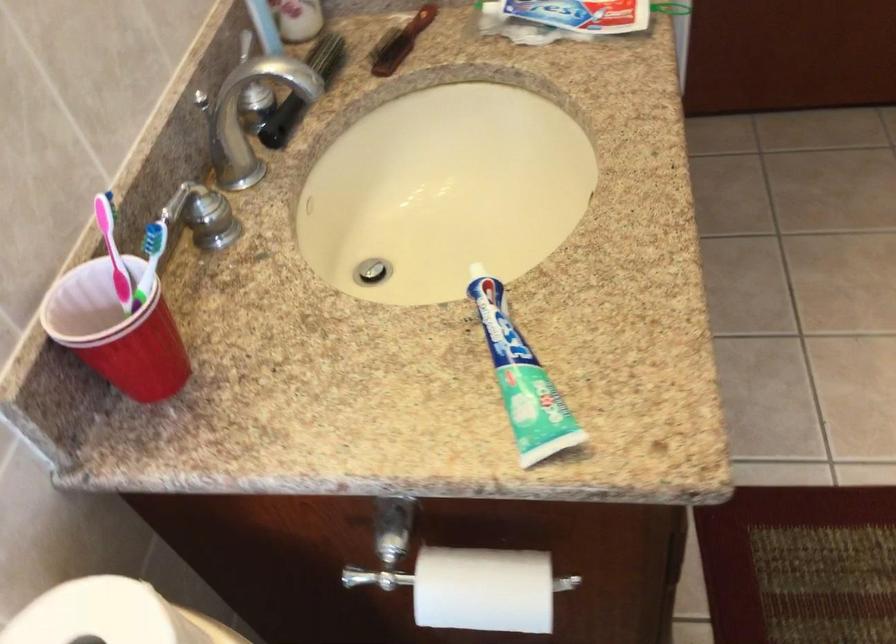
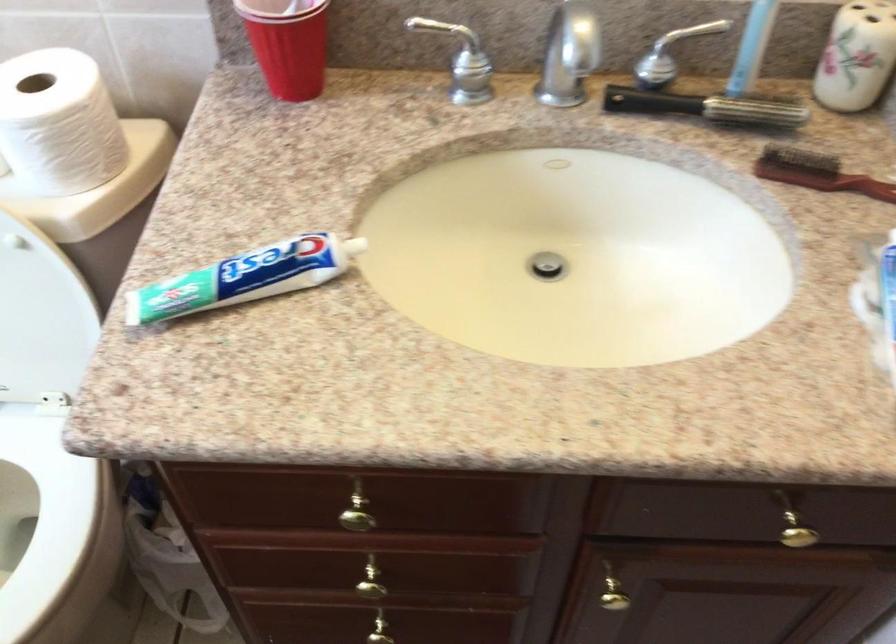
Find the pixel in the second image that matches the point at 519,346 in the first image.

(245, 277)